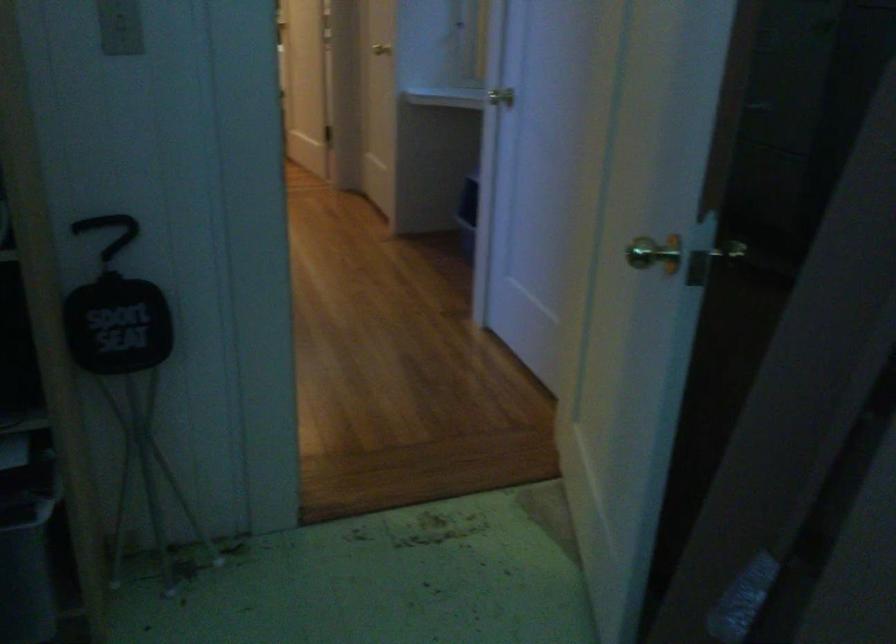
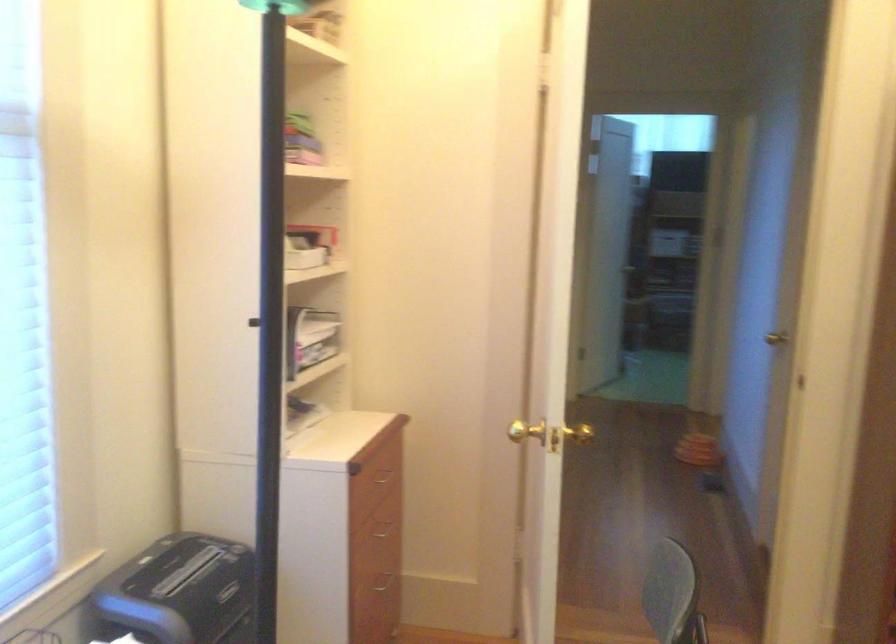
Question: I am providing you with two images of the same scene from different viewpoints. Which of the following objects are not visible in image2?

Choices:
 (A) gold door knob
 (B) black bottle lid
 (C) seat handle
 (D) black paper shredder

Answer: (C)